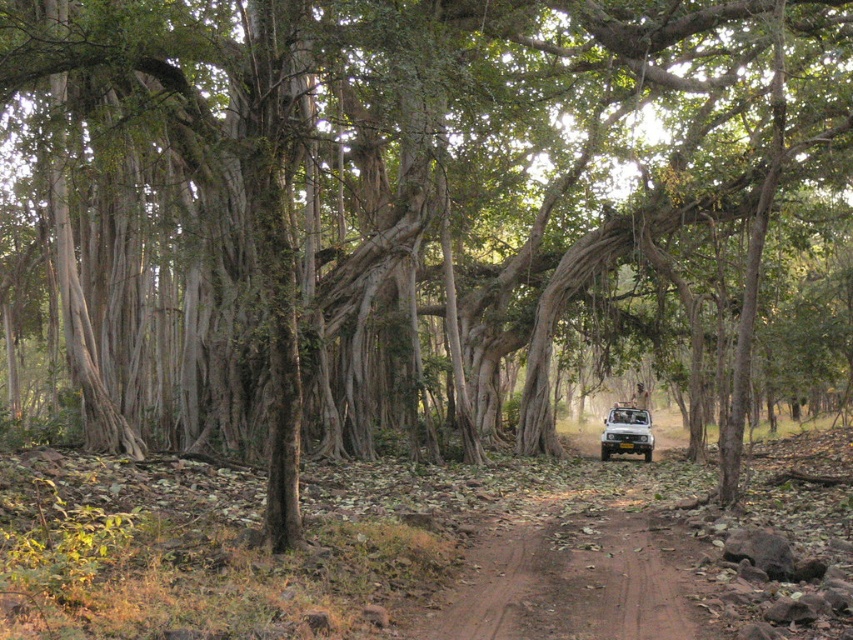
You are standing at the entrance of the forest and want to reach the brown dirt track at center. Which direction should you walk to get there?

The brown dirt track at center is located at point (567, 582), so you should walk towards the center of the image to reach it.

You are a hiker trying to find your way back to the jeep. You see the brown dirt track at center and the yellow matte jeep at center. Which one is more to the left?

The brown dirt track at center is positioned on the left side of the yellow matte jeep at center, so the brown dirt track at center is more to the left.